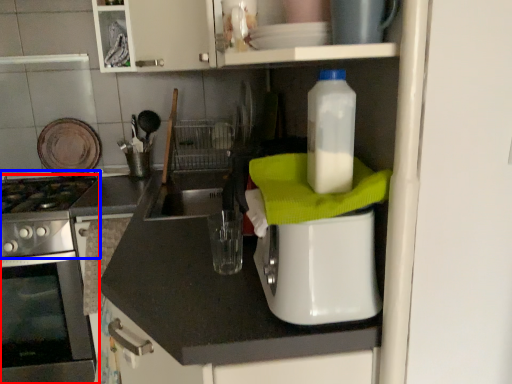
Question: Which object appears farthest to the camera in this image, home appliance (highlighted by a red box) or gas stove (highlighted by a blue box)?

Choices:
 (A) home appliance
 (B) gas stove

Answer: (A)